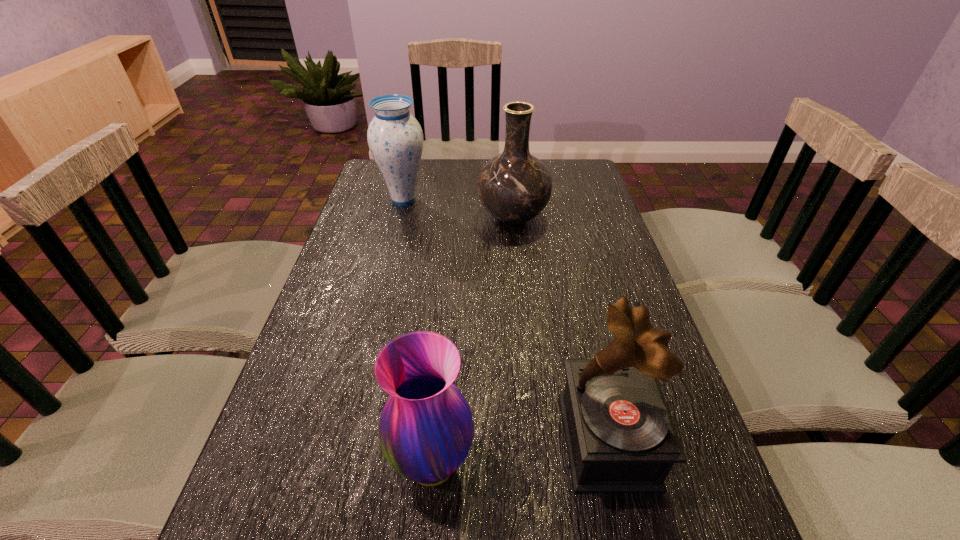
You are a GUI agent. You are given a task and a screenshot of the screen. Output one action in this format:
    pyautogui.click(x=<x>, y=<y>)
    Task: Click on the vase that stands as the closest to the rightmost vase
    This screenshot has height=540, width=960.
    Given the screenshot: What is the action you would take?
    pyautogui.click(x=395, y=138)

You are a GUI agent. You are given a task and a screenshot of the screen. Output one action in this format:
    pyautogui.click(x=<x>, y=<y>)
    Task: Click on the vacant space that satisfies the following two spatial constraints: 1. at the horn opening of the phonograph_record; 2. on the front side of the second vase from left to right
    The image size is (960, 540).
    Given the screenshot: What is the action you would take?
    pyautogui.click(x=613, y=465)

Where is `free space that satisfies the following two spatial constraints: 1. on the front side of the leftmost vase; 2. on the left side of the rightmost vase`? free space that satisfies the following two spatial constraints: 1. on the front side of the leftmost vase; 2. on the left side of the rightmost vase is located at coordinates (399, 218).

Find the location of a particular element. vacant space that satisfies the following two spatial constraints: 1. on the back side of the rightmost vase; 2. on the left side of the second object from left to right is located at coordinates [453, 218].